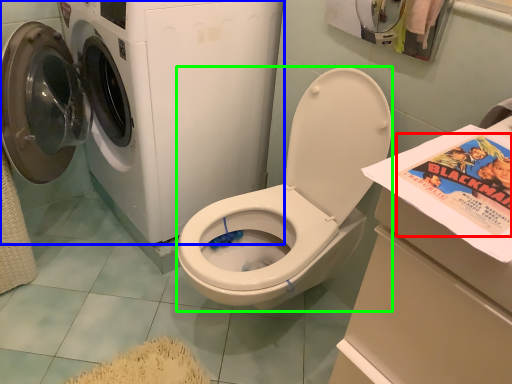
Question: Considering the real-world distances, which object is closest to comic book (highlighted by a red box)? washing machine (highlighted by a blue box) or washer (highlighted by a green box).

Choices:
 (A) washing machine
 (B) washer

Answer: (B)